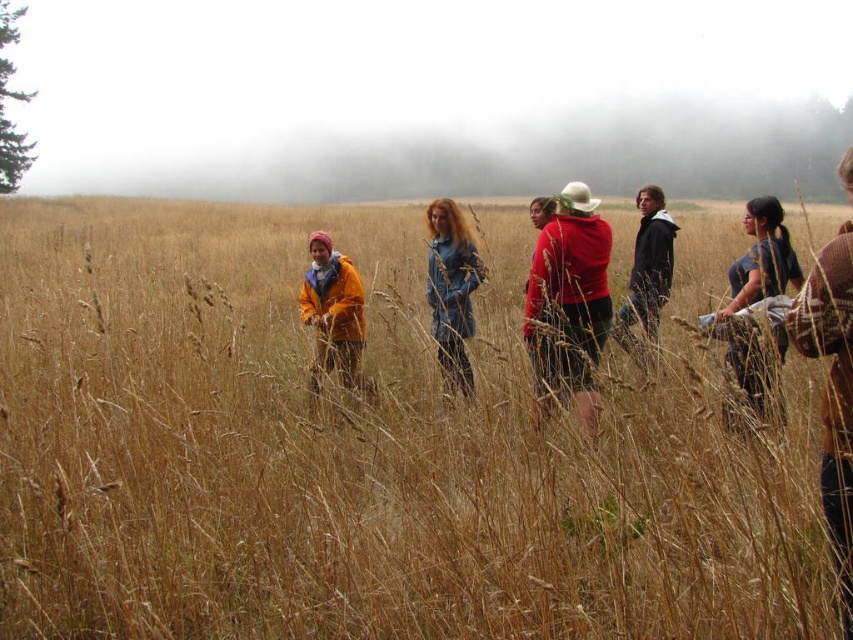
You are a photographer trying to capture a clear shot of both the matte yellow jacket at center and the dark gray hoodie at center in the foggy field. Since the fog reduces visibility, which of the two subjects will appear more clearly in your photo?

The matte yellow jacket at center will appear more clearly in the photo because it is closer to the viewer than the dark gray hoodie at center, making it less affected by the fog.

You are an outdoor photographer trying to capture a shot of the red matte hoodie at center and the brown dry grass at center. Based on their positions, which object is located to the right side of the other?

The brown dry grass at center is to the left of the red matte hoodie at center, so the red matte hoodie at center is to the right of the brown dry grass at center.